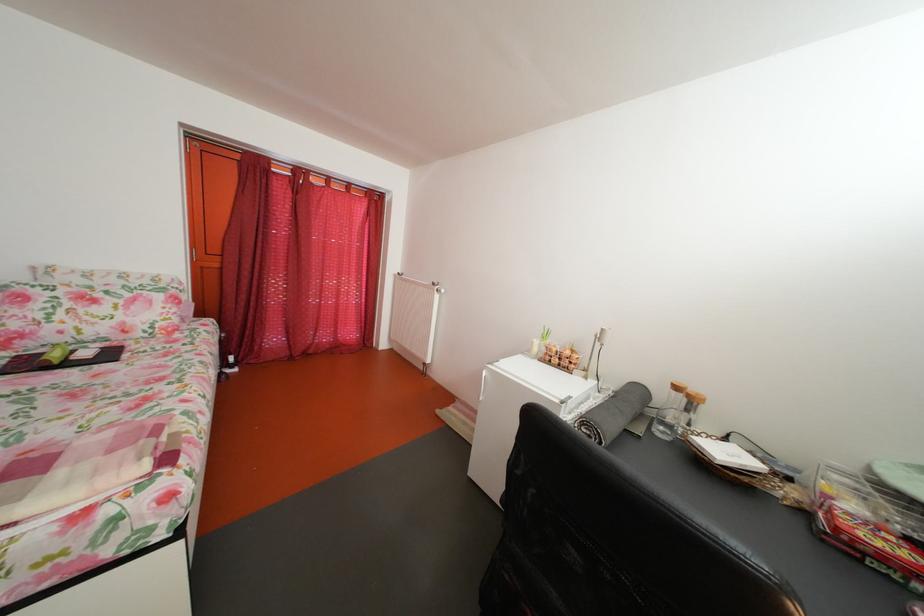
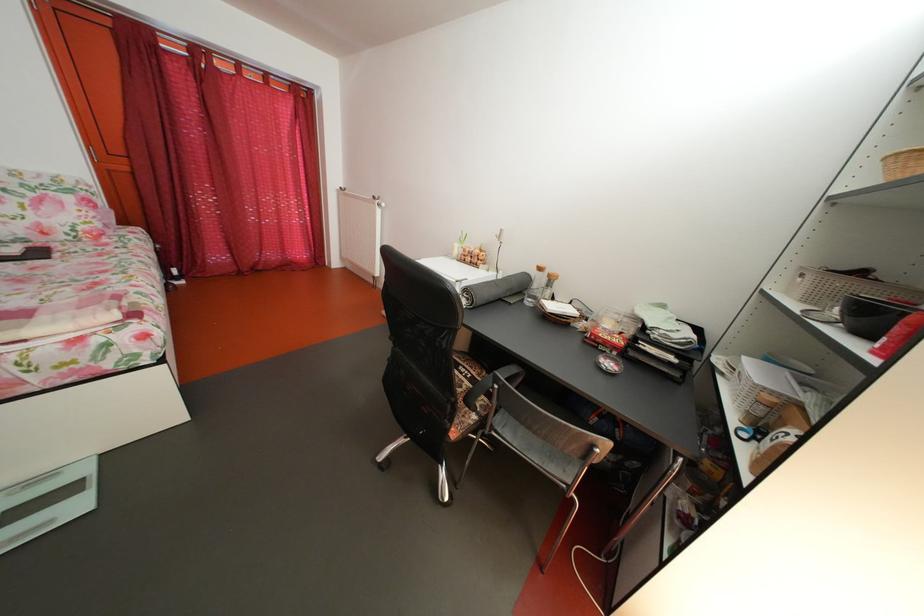
What movement of the cameraman would produce the second image?

The cameraman walked toward right, backward.